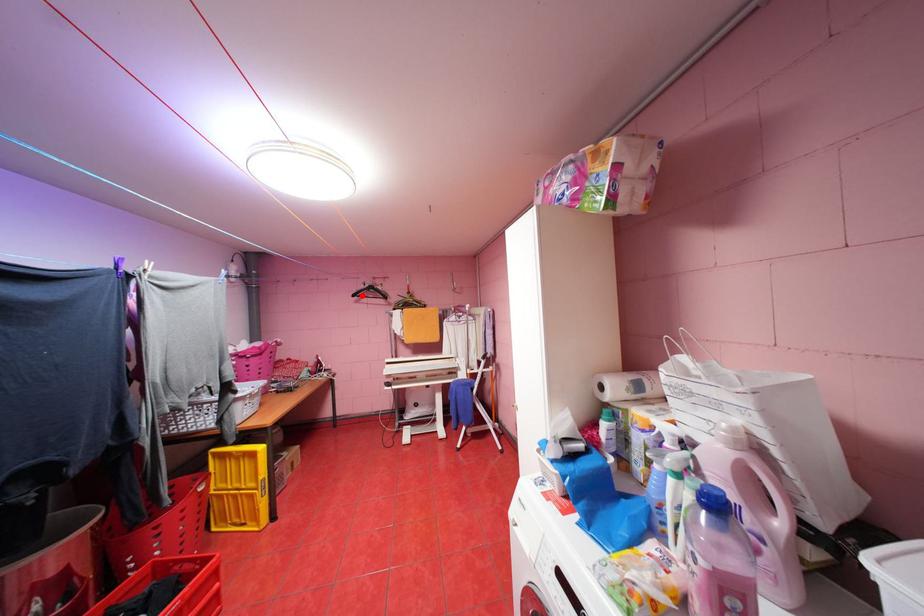
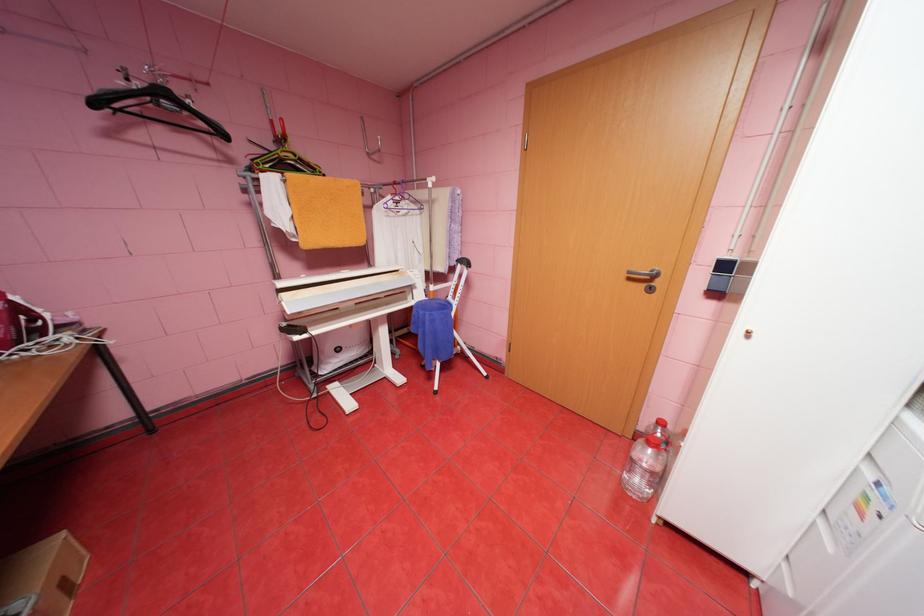
In the second image, find the point that corresponds to the highlighted location in the first image.

(103, 103)